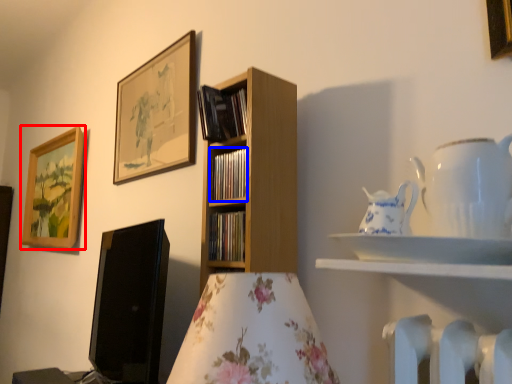
Question: Which point is closer to the camera, picture frame (highlighted by a red box) or book (highlighted by a blue box)?

Choices:
 (A) picture frame
 (B) book

Answer: (B)